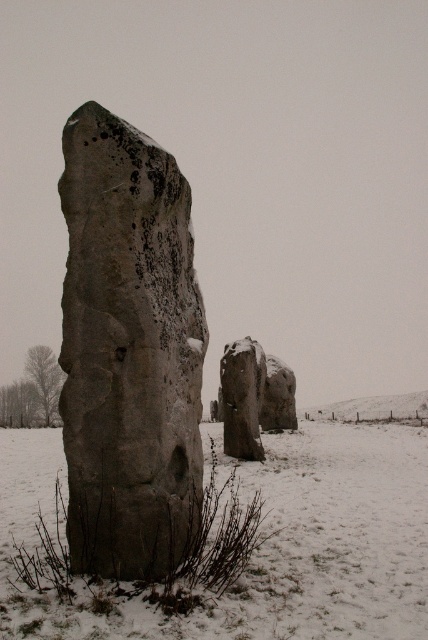
Question: Does rough stone monolith at center come behind gray stone monolith at left?

Choices:
 (A) yes
 (B) no

Answer: (A)

Question: Which of the following is the farthest from the observer?

Choices:
 (A) smooth gray rock at center
 (B) rough stone monolith at center
 (C) gray stone monolith at left

Answer: (A)

Question: Estimate the real-world distances between objects in this image. Which object is farther from the gray stone monolith at left?

Choices:
 (A) rough stone monolith at center
 (B) smooth gray rock at center

Answer: (A)

Question: Observing the image, what is the correct spatial positioning of gray stone monolith at left in reference to smooth gray rock at center?

Choices:
 (A) below
 (B) above

Answer: (A)

Question: Where is rough stone monolith at center located in relation to smooth gray rock at center in the image?

Choices:
 (A) below
 (B) above

Answer: (B)

Question: Which is farther from the smooth gray rock at center?

Choices:
 (A) rough stone monolith at center
 (B) gray stone monolith at left

Answer: (A)